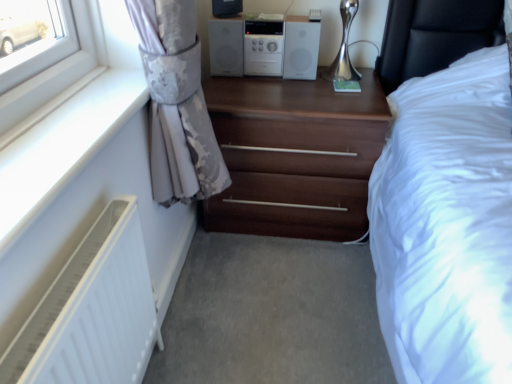
Identify the location of blank space situated above white matte radiator at lower left (from a real-world perspective). Image resolution: width=512 pixels, height=384 pixels. (82, 258).